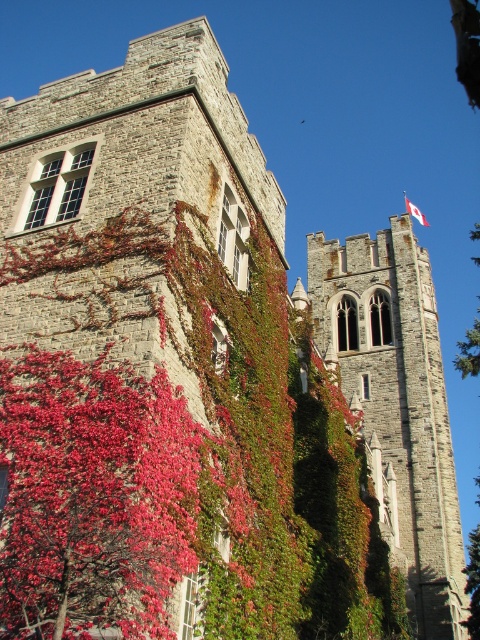
You are standing in front of a historic stone building with autumn leaves. There is a point marked at coordinates (94, 497). What color are the leaves at that point?

The point at (94, 497) marks vivid red leaves at center.